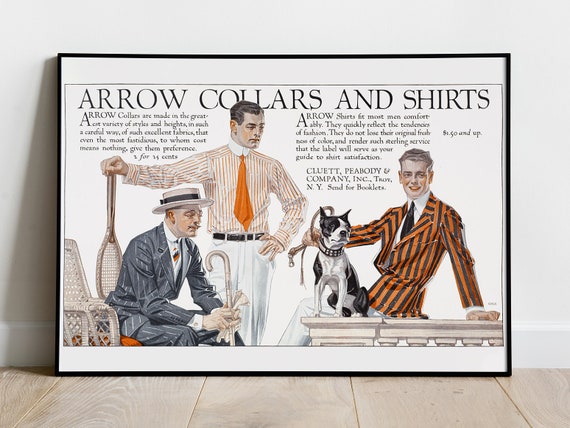
Identify the location of baseboards. The height and width of the screenshot is (428, 570). (32, 337).